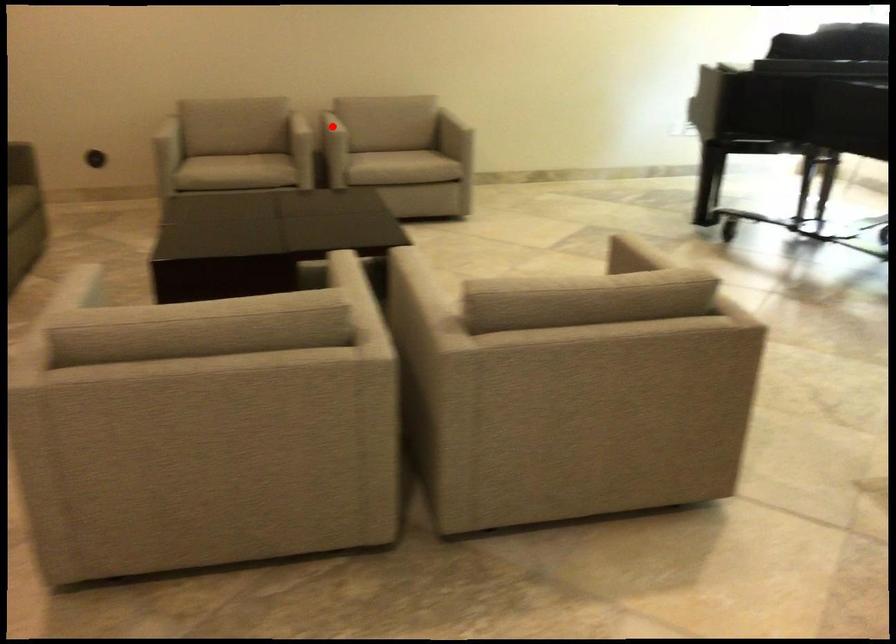
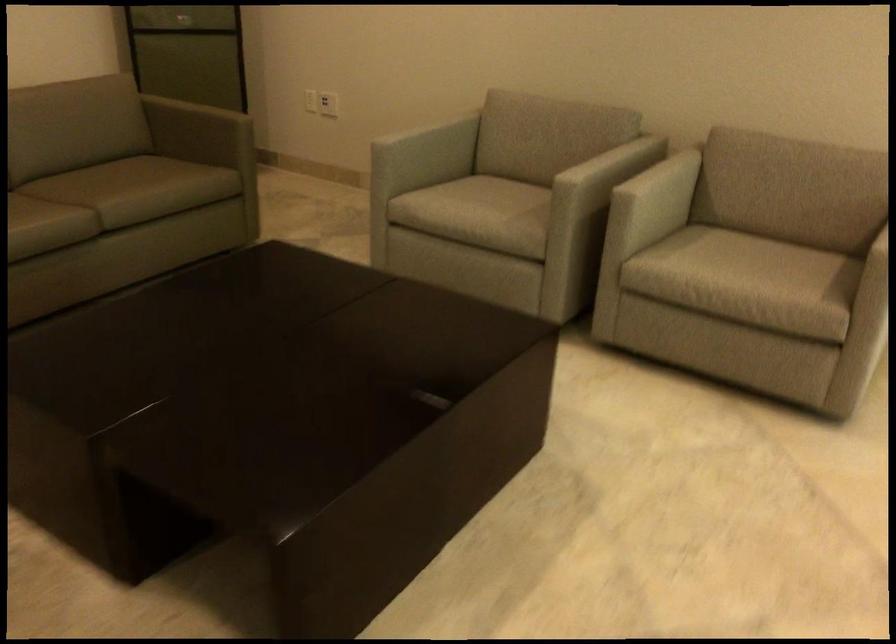
Question: I am providing you with two images of the same scene from different viewpoints. Image1 has a red point marked. In image2, the corresponding 3D location appears at what relative position? Reply with the corresponding letter.

Choices:
 (A) Closer
 (B) Farther

Answer: (A)